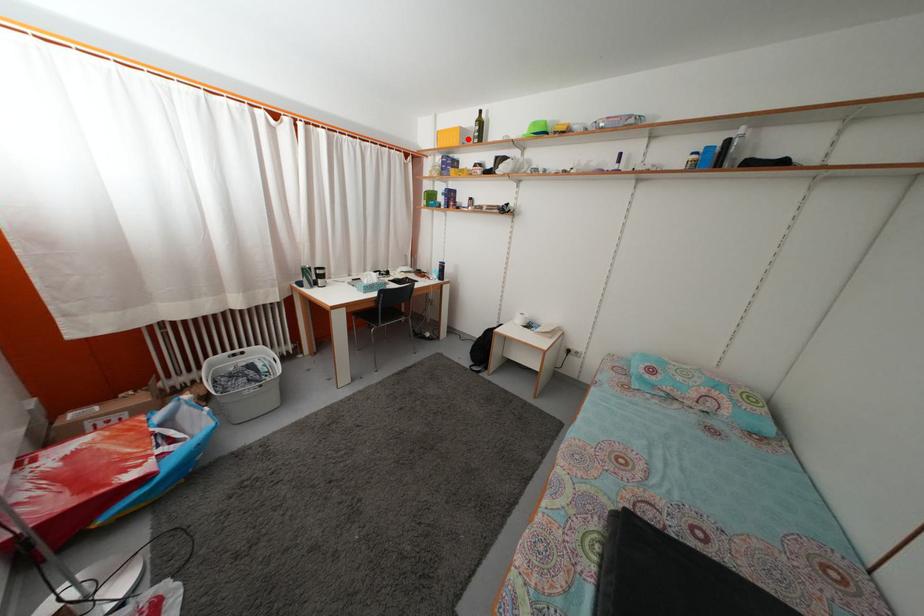
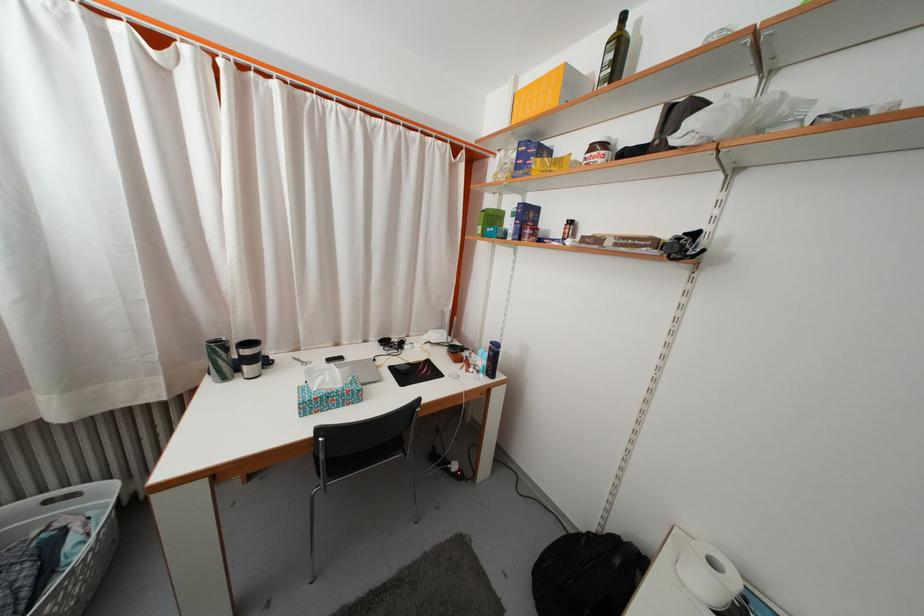
Find the pixel in the second image that matches the highlighted location in the first image.

(575, 84)